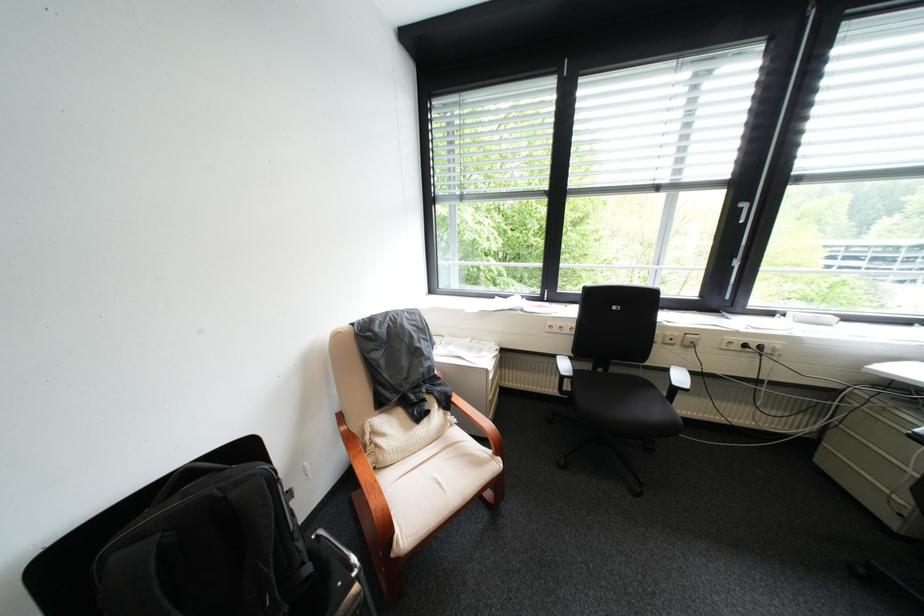
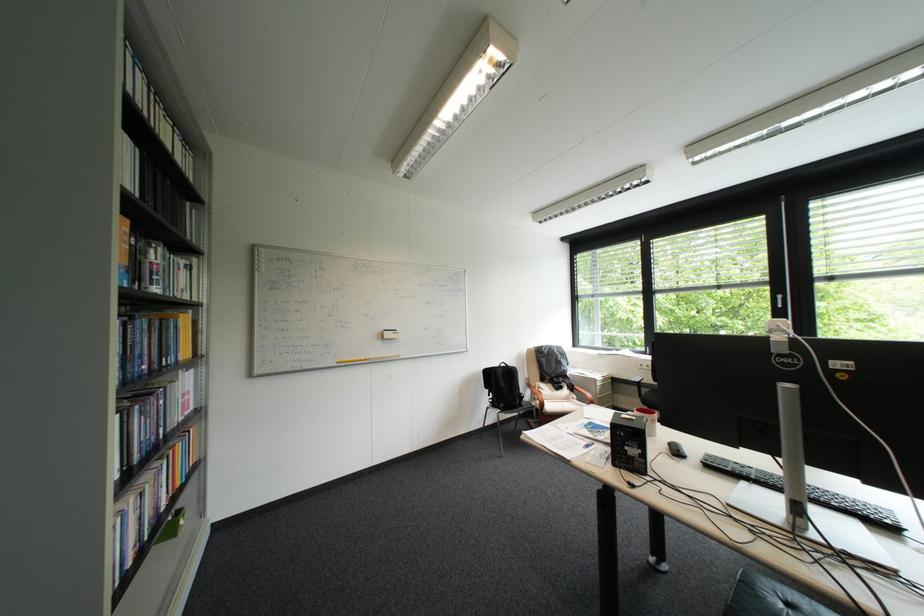
Find the pixel in the second image that matches [499,370] in the first image.

(608, 379)